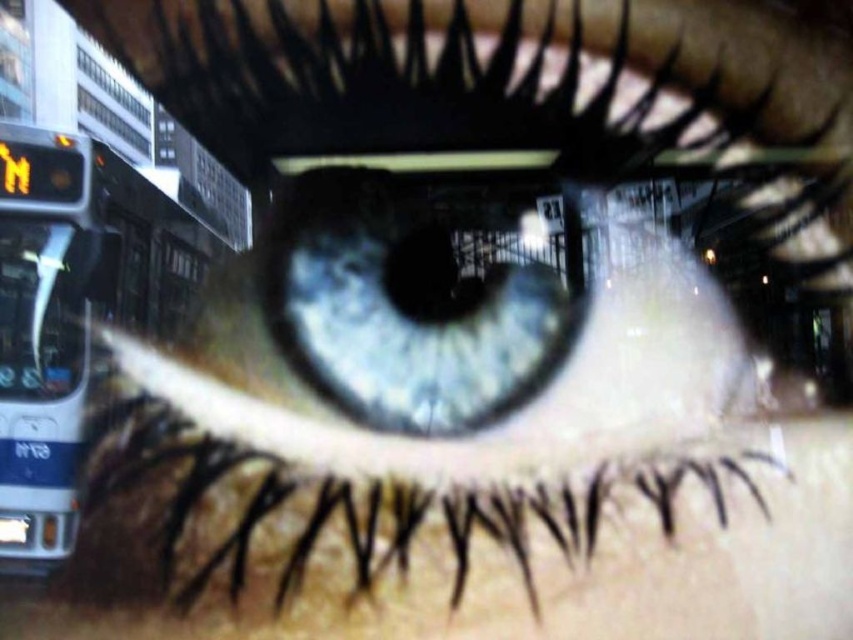
Question: Is blue iridescent eye at center positioned in front of white plastic bus at left?

Choices:
 (A) yes
 (B) no

Answer: (B)

Question: Which of the following is the closest to the observer?

Choices:
 (A) blue iridescent eye at center
 (B) white plastic bus at left

Answer: (B)

Question: Which of the following is the closest to the observer?

Choices:
 (A) white plastic bus at left
 (B) blue iridescent eye at center

Answer: (A)

Question: From the image, what is the correct spatial relationship of blue iridescent eye at center in relation to white plastic bus at left?

Choices:
 (A) left
 (B) right

Answer: (B)

Question: Where is blue iridescent eye at center located in relation to white plastic bus at left in the image?

Choices:
 (A) left
 (B) right

Answer: (B)